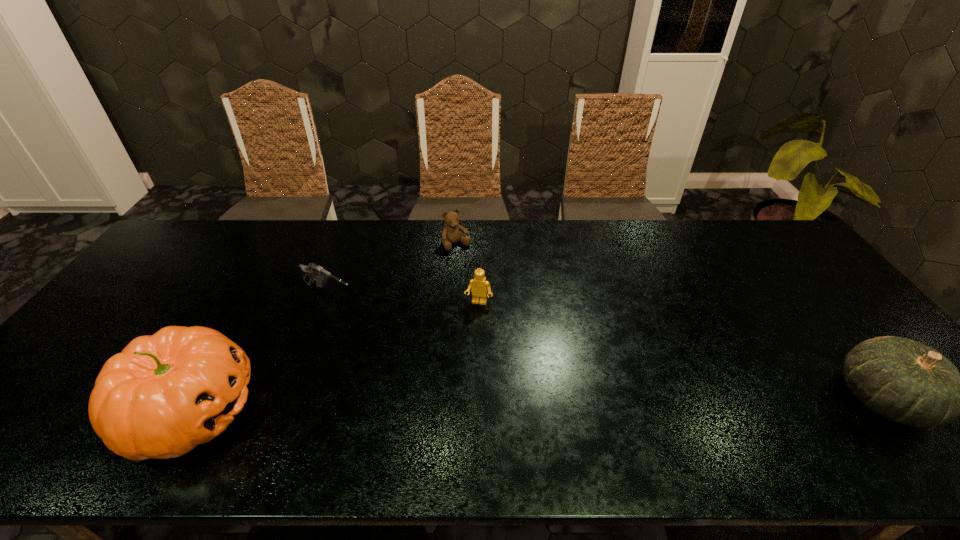
Locate an element on the screen. This screenshot has width=960, height=540. pumpkin is located at coordinates (164, 394).

The width and height of the screenshot is (960, 540). Identify the location of the farthest object. pos(451,233).

The width and height of the screenshot is (960, 540). I want to click on gun, so click(312, 270).

Identify the location of Lego. (479, 285).

This screenshot has height=540, width=960. In order to click on blank space located 0.060m on the carved face of the pumpkin in this screenshot , I will do `click(282, 410)`.

Find the location of `vacant space located 0.180m on the front-facing side of the teddy bear`. vacant space located 0.180m on the front-facing side of the teddy bear is located at coordinates (487, 285).

Identify the location of blank area located on the front-facing side of the teddy bear. This screenshot has width=960, height=540. (468, 261).

Find the location of a particular element. This screenshot has width=960, height=540. free spot located on the front-facing side of the teddy bear is located at coordinates (486, 283).

Find the location of a particular element. The width and height of the screenshot is (960, 540). vacant area situated at the barrel of the gun is located at coordinates (445, 362).

At what (x,y) coordinates should I click in order to perform the action: click on vacant space located 0.200m at the barrel of the gun. Please return your answer as a coordinate pair (x, y). This screenshot has width=960, height=540. Looking at the image, I should click on (402, 336).